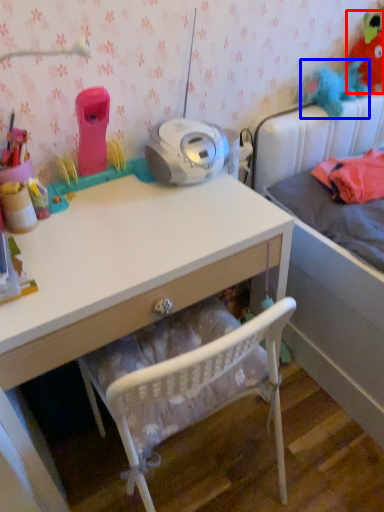
Question: Which object is further to the camera taking this photo, toy (highlighted by a red box) or toy (highlighted by a blue box)?

Choices:
 (A) toy
 (B) toy

Answer: (A)